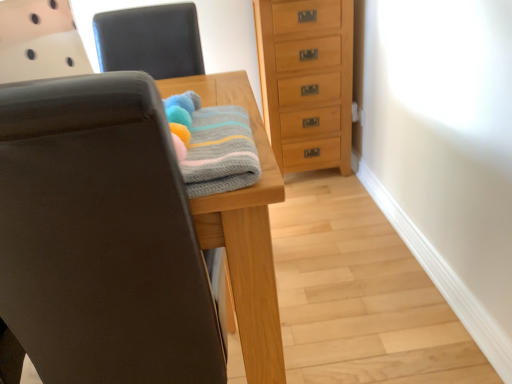
Identify the location of free space above knitted cotton towel at center (from a real-world perspective). Image resolution: width=512 pixels, height=384 pixels. (204, 129).